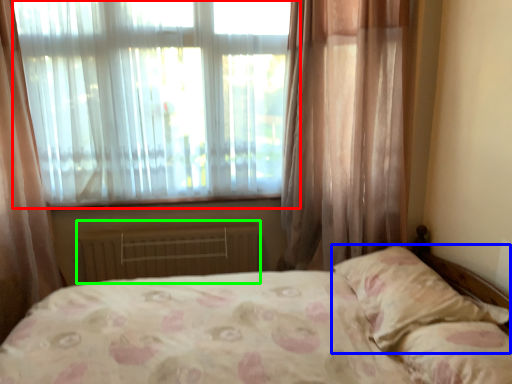
Question: Which object is positioned farthest from window (highlighted by a red box)? Select from pillow (highlighted by a blue box) and radiator (highlighted by a green box).

Choices:
 (A) pillow
 (B) radiator

Answer: (A)